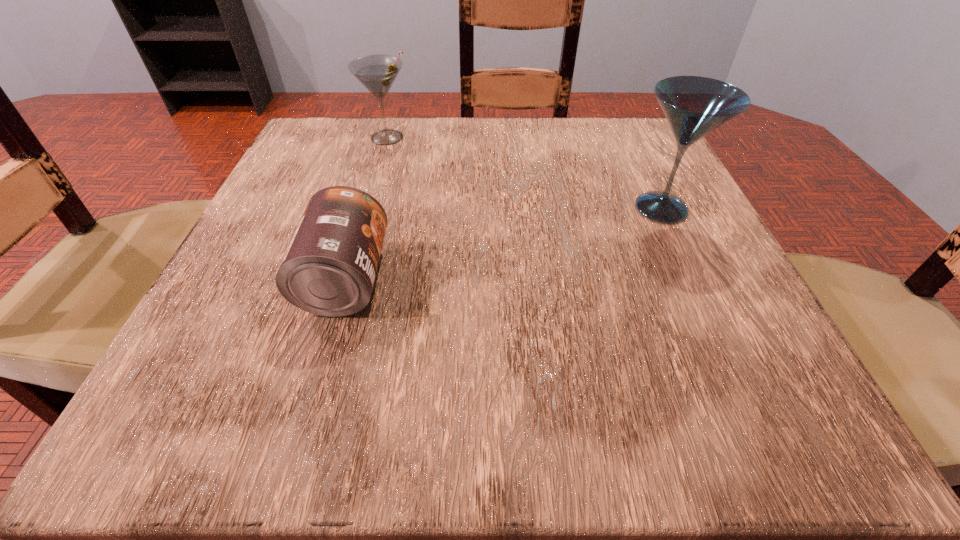
In the image, there is a desktop. Identify the location of vacant space at the far right corner. The width and height of the screenshot is (960, 540). [631, 152].

I want to click on empty space that is in between the right martini and the shortest object, so click(x=503, y=244).

Identify the location of vacant space that's between the right martini and the farthest object. This screenshot has height=540, width=960. (524, 173).

At what (x,y) coordinates should I click in order to perform the action: click on free space between the nearest object and the right martini. Please return your answer as a coordinate pair (x, y). The height and width of the screenshot is (540, 960). Looking at the image, I should click on (503, 244).

This screenshot has height=540, width=960. What are the coordinates of `free space that is in between the nearer martini and the shorter martini` in the screenshot? It's located at (524, 173).

Where is `free area in between the shorter martini and the nearer martini`? free area in between the shorter martini and the nearer martini is located at coordinates (524, 173).

Point out which object is positioned as the second nearest to the rightmost object. Please provide its 2D coordinates. Your answer should be formatted as a tuple, i.e. [(x, y)], where the tuple contains the x and y coordinates of a point satisfying the conditions above.

[(377, 73)]

Locate which object is the second closest to the can. Please provide its 2D coordinates. Your answer should be formatted as a tuple, i.e. [(x, y)], where the tuple contains the x and y coordinates of a point satisfying the conditions above.

[(694, 106)]

The height and width of the screenshot is (540, 960). I want to click on free space that satisfies the following two spatial constraints: 1. on the front side of the taller martini; 2. on the left side of the left martini, so click(367, 208).